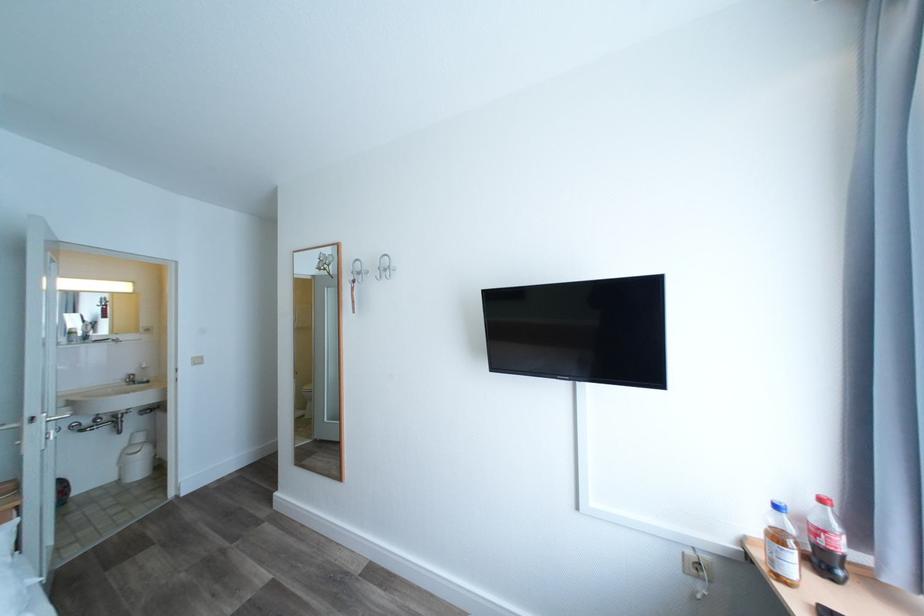
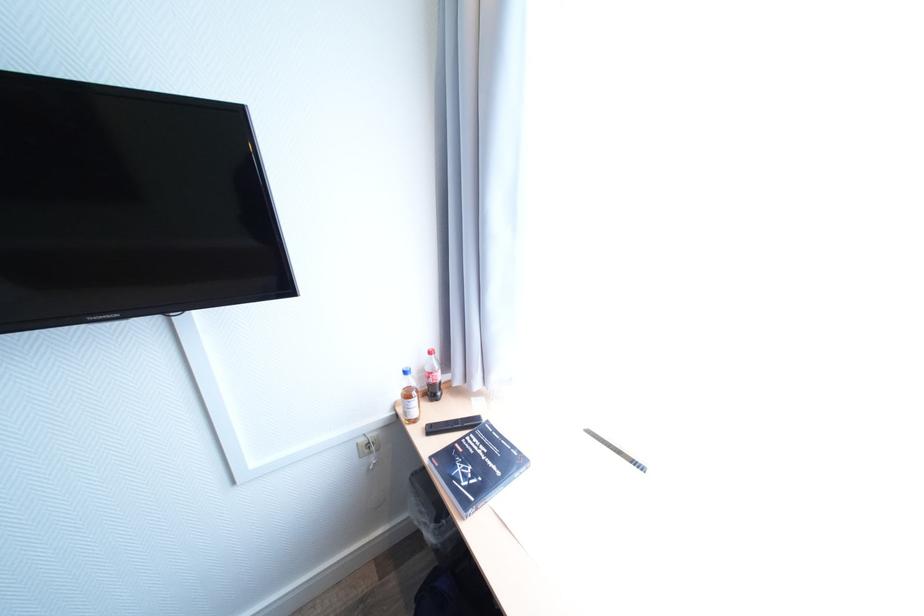
The point at (752, 539) is marked in the first image. Where is the corresponding point in the second image?

(403, 403)